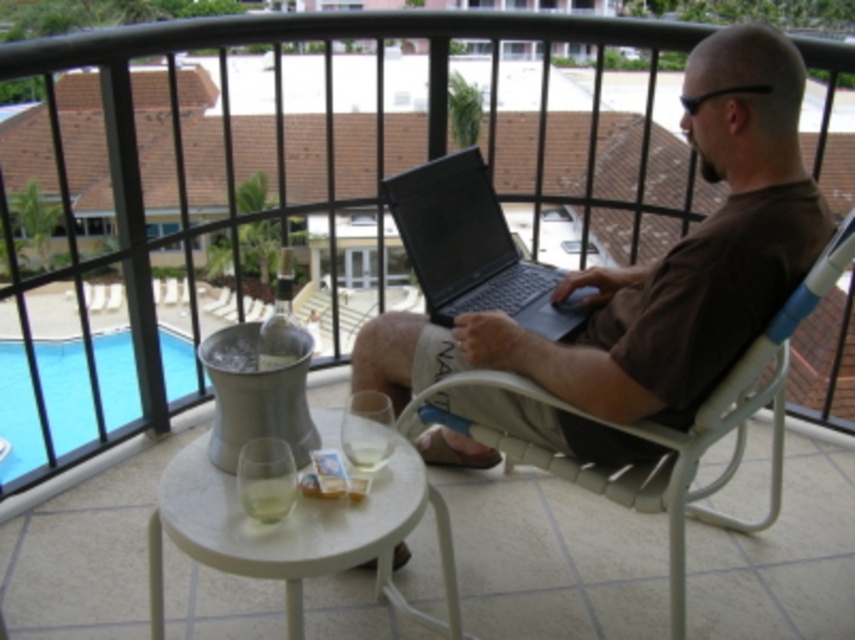
You are a fashion designer observing the man in the image. You need to determine if the brown cotton shirt at center can be replaced with a wider version without affecting the placement of the black matte laptop at center. Is this possible?

The brown cotton shirt at center might be wider than black matte laptop at center, so replacing it with a wider version could potentially cause overcrowding and affect the laptop placement.

You are a photographer adjusting your camera to capture the scene on the balcony. You notice two points in the image labeled as point (727, 76) and point (476, 426). Which of these points should appear larger in your photo?

Point (727, 76) is closer to the camera than point (476, 426), so it will appear larger in the photo.